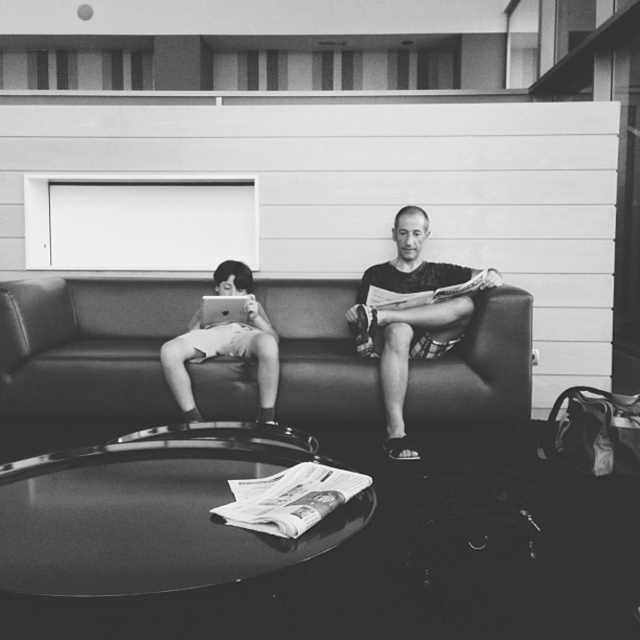
You are an interior designer planning to place a new sofa in a room. You see the leather couch at center and the matte black laptop at left in the image. Which object should you consider moving if you want to create more space between the sofa and the laptop?

You should consider moving the leather couch at center because it is currently in front of the matte black laptop at left, so moving it would create more space between them.

You are standing in front of the sofa and want to place a small vase on the coffee table. The coffee table has two spots marked as point A at coordinates point A is at point (220, 365) and point B is at point (234, 308). Which point is closer to you so the vase won t fall off the edge?

Point A at point (220, 365) is closer to the viewer than point B at point (234, 308), so placing the vase there would be safer as it is nearer to your reach.

Based on the photo, you are a delivery robot with a package that is 12 inches long. You need to place it between the leather couch at center and the smooth beige shorts at left. Is there enough space to fit the package horizontally between them?

The distance between the leather couch at center and the smooth beige shorts at left is 11.96 inches. Since the package is 12 inches long, there is not enough space to fit it horizontally between them.